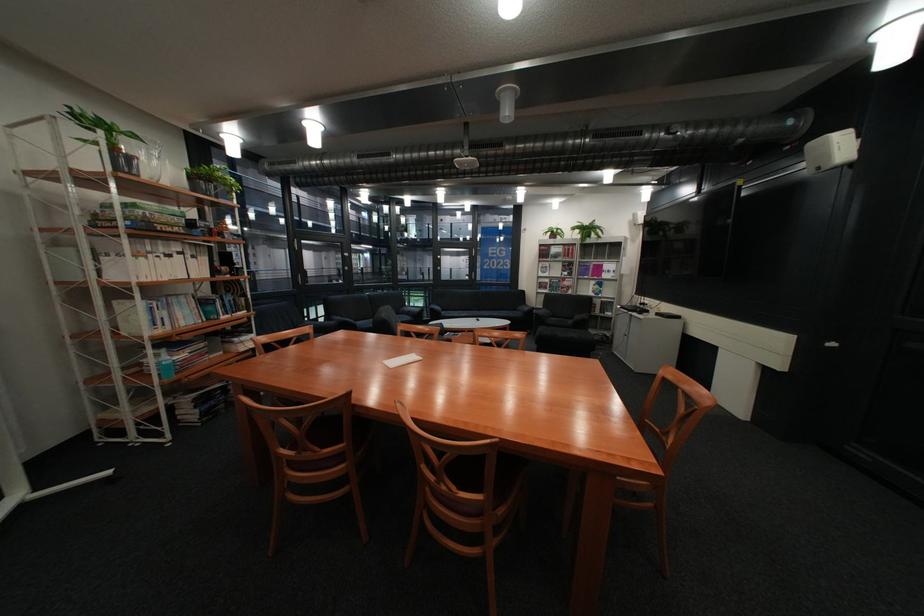
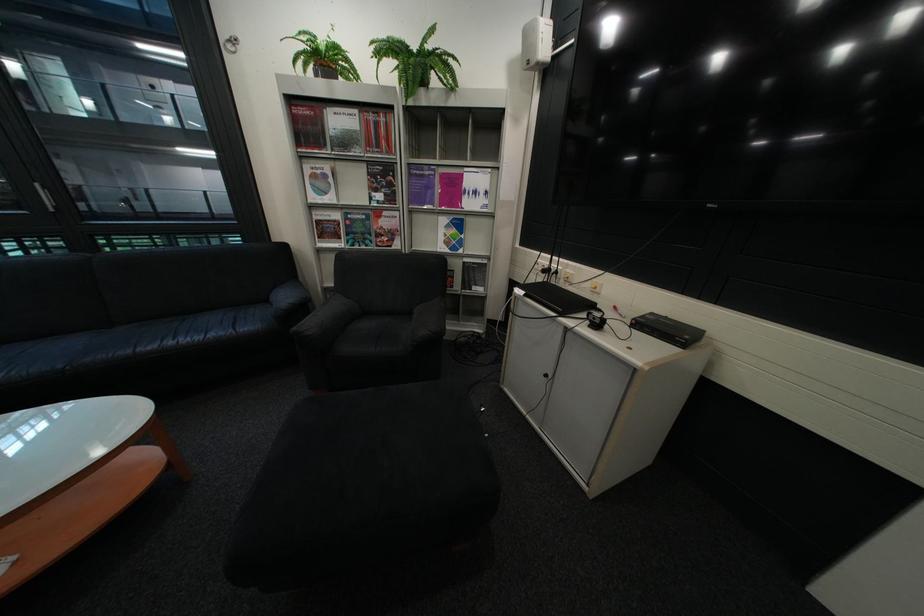
Where in the second image is the point corresponding to point 556,267 from the first image?

(329, 177)